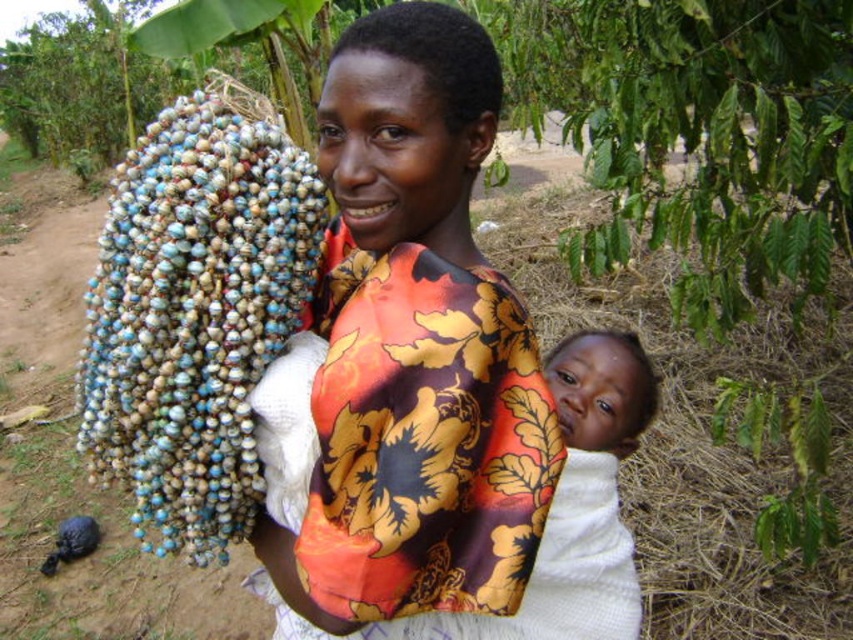
Question: Does beaded necklace at left have a larger size compared to white knitted cloth at center?

Choices:
 (A) no
 (B) yes

Answer: (B)

Question: Which object appears closest to the camera in this image?

Choices:
 (A) beaded necklace at left
 (B) floral silk blouse at center
 (C) white knitted cloth at center

Answer: (B)

Question: Which of the following is the closest to the observer?

Choices:
 (A) (103, 241)
 (B) (606, 428)

Answer: (A)

Question: Is beaded necklace at left below white knitted cloth at center?

Choices:
 (A) no
 (B) yes

Answer: (A)

Question: Is the position of beaded necklace at left more distant than that of white knitted cloth at center?

Choices:
 (A) yes
 (B) no

Answer: (A)

Question: Which point appears closest to the camera in this image?

Choices:
 (A) (241, 154)
 (B) (332, 243)

Answer: (A)